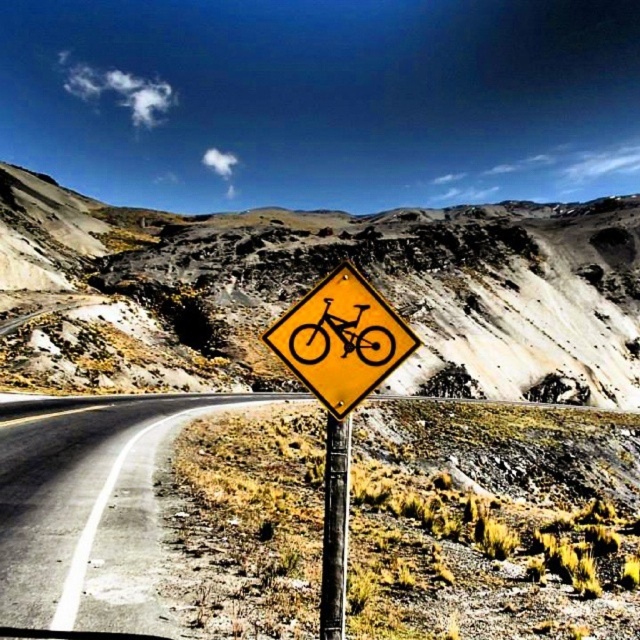
Question: Which point is farther to the camera?

Choices:
 (A) yellow diamond sign at center
 (B) asphalt road at center
 (C) metallic pole at center

Answer: (A)

Question: Which is nearer to the metallic pole at center?

Choices:
 (A) asphalt road at center
 (B) yellow matte bicycle at center
 (C) yellow matte sign at center
 (D) yellow diamond sign at center

Answer: (C)

Question: Is yellow matte sign at center below metallic pole at center?

Choices:
 (A) no
 (B) yes

Answer: (A)

Question: Can you confirm if yellow diamond sign at center is wider than yellow matte sign at center?

Choices:
 (A) yes
 (B) no

Answer: (A)

Question: Is asphalt road at center above yellow matte bicycle sign at center?

Choices:
 (A) yes
 (B) no

Answer: (B)

Question: Among these points, which one is farthest from the camera?

Choices:
 (A) (305, 298)
 (B) (358, 326)

Answer: (A)